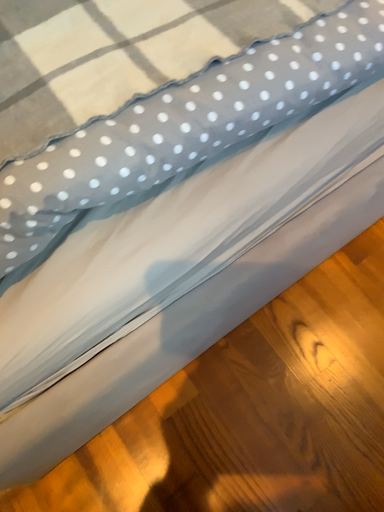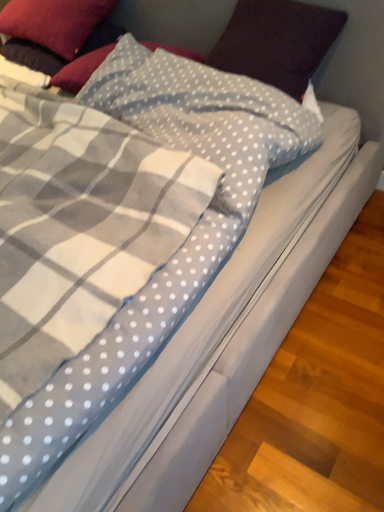
Question: Which way did the camera rotate in the video?

Choices:
 (A) rotated upward
 (B) rotated downward

Answer: (A)